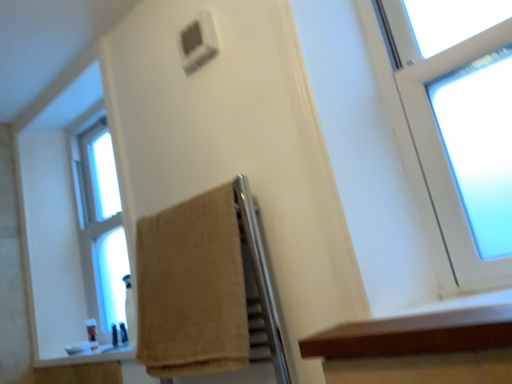
The image size is (512, 384). Describe the element at coordinates (192, 288) in the screenshot. I see `beige cotton towel at center` at that location.

Locate an element on the screen. translucent plastic soap at lower left is located at coordinates (91, 333).

Image resolution: width=512 pixels, height=384 pixels. What are the coordinates of `brown wood ledge at lower right` in the screenshot? It's located at (415, 334).

Locate an element on the screen. toiletry to the right of clear glass window at left is located at coordinates (91, 333).

Between clear glass window at left and translucent plastic soap at lower left, which one has more height?

Standing taller between the two is clear glass window at left.

From the image's perspective, is clear glass window at left above or below translucent plastic soap at lower left?

From the image's perspective, clear glass window at left appears above translucent plastic soap at lower left.

Could you tell me if clear glass window at left is facing translucent plastic soap at lower left?

Yes, clear glass window at left faces towards translucent plastic soap at lower left.

From their relative heights in the image, would you say clear glass window at left is taller or shorter than beige cotton towel at center?

Clearly, clear glass window at left is taller compared to beige cotton towel at center.

From the image's perspective, is clear glass window at left on top of beige cotton towel at center?

Correct, clear glass window at left appears higher than beige cotton towel at center in the image.

Considering the relative positions of clear glass window at left and beige cotton towel at center in the image provided, is clear glass window at left to the right of beige cotton towel at center from the viewer's perspective?

No, clear glass window at left is not to the right of beige cotton towel at center.

Looking at this image, is beige cotton towel at center aimed at translucent plastic soap at lower left?

No, beige cotton towel at center is not aimed at translucent plastic soap at lower left.

Can you confirm if beige cotton towel at center is taller than translucent plastic soap at lower left?

Yes, beige cotton towel at center is taller than translucent plastic soap at lower left.

Is beige cotton towel at center to the left of translucent plastic soap at lower left from the viewer's perspective?

No, beige cotton towel at center is not to the left of translucent plastic soap at lower left.

From a real-world perspective, relative to translucent plastic soap at lower left, is beige cotton towel at center vertically above or below?

beige cotton towel at center is situated higher than translucent plastic soap at lower left in the real world.

Looking at this image, could you tell me if translucent plastic soap at lower left is facing beige cotton towel at center?

No, translucent plastic soap at lower left is not facing towards beige cotton towel at center.

From a real-world perspective, between translucent plastic soap at lower left and beige cotton towel at center, who is vertically higher?

beige cotton towel at center is physically above.

Is translucent plastic soap at lower left touching beige cotton towel at center?

They are not placed beside each other.

Find the location of a particular element. The image size is (512, 384). window that is behind the brown wood ledge at lower right is located at coordinates (101, 226).

From a real-world perspective, who is located higher, brown wood ledge at lower right or clear glass window at left?

clear glass window at left.

Can you confirm if brown wood ledge at lower right is bigger than clear glass window at left?

No.

Would you say brown wood ledge at lower right is to the left or to the right of clear glass window at left in the picture?

Clearly, brown wood ledge at lower right is on the right of clear glass window at left in the image.

Does brown wood ledge at lower right contain beige cotton towel at center?

Definitely not — beige cotton towel at center is not inside brown wood ledge at lower right.

Is the position of brown wood ledge at lower right more distant than that of beige cotton towel at center?

No, brown wood ledge at lower right is closer to the camera.

The height and width of the screenshot is (384, 512). Identify the location of towel to the left of brown wood ledge at lower right. (192, 288).

Can you confirm if brown wood ledge at lower right is shorter than beige cotton towel at center?

Correct, brown wood ledge at lower right is not as tall as beige cotton towel at center.

In terms of width, does clear glass window at left look wider or thinner when compared to brown wood ledge at lower right?

Considering their sizes, clear glass window at left looks slimmer than brown wood ledge at lower right.

In the scene shown: Which of these two, clear glass window at left or brown wood ledge at lower right, stands shorter?

A: brown wood ledge at lower right is shorter.

Is clear glass window at left surrounding brown wood ledge at lower right?

No, brown wood ledge at lower right is not surrounded by clear glass window at left.

Locate an element on the screen. toiletry below the clear glass window at left (from a real-world perspective) is located at coordinates (91, 333).

Find the location of a particular element. This screenshot has width=512, height=384. towel below the clear glass window at left (from the image's perspective) is located at coordinates (192, 288).

From the image, which object appears to be nearer to translucent plastic soap at lower left, beige cotton towel at center or brown wood ledge at lower right?

beige cotton towel at center.

Which object lies nearer to the anchor point clear glass window at left, brown wood ledge at lower right or beige cotton towel at center?

Among the two, beige cotton towel at center is located nearer to clear glass window at left.

Which object lies nearer to the anchor point translucent plastic soap at lower left, brown wood ledge at lower right or beige cotton towel at center?

Based on the image, beige cotton towel at center appears to be nearer to translucent plastic soap at lower left.

Based on their spatial positions, is translucent plastic soap at lower left or clear glass window at left further from brown wood ledge at lower right?

translucent plastic soap at lower left is positioned further to the anchor brown wood ledge at lower right.

Considering their positions, is clear glass window at left positioned further to translucent plastic soap at lower left than beige cotton towel at center?

beige cotton towel at center lies further to translucent plastic soap at lower left than the other object.

Based on the photo, estimate the real-world distances between objects in this image. Which object is further from beige cotton towel at center, brown wood ledge at lower right or translucent plastic soap at lower left?

translucent plastic soap at lower left is further to beige cotton towel at center.

Which object lies nearer to the anchor point beige cotton towel at center, translucent plastic soap at lower left or brown wood ledge at lower right?

The object closer to beige cotton towel at center is brown wood ledge at lower right.

Based on their spatial positions, is clear glass window at left or beige cotton towel at center closer to brown wood ledge at lower right?

beige cotton towel at center is closer to brown wood ledge at lower right.

This screenshot has height=384, width=512. What are the coordinates of `towel positioned between brown wood ledge at lower right and translucent plastic soap at lower left from near to far` in the screenshot? It's located at (192, 288).

This screenshot has width=512, height=384. I want to click on towel between brown wood ledge at lower right and clear glass window at left from front to back, so click(x=192, y=288).

Where is `toiletry between brown wood ledge at lower right and clear glass window at left along the z-axis`? The height and width of the screenshot is (384, 512). toiletry between brown wood ledge at lower right and clear glass window at left along the z-axis is located at coordinates (91, 333).

At what (x,y) coordinates should I click in order to perform the action: click on toiletry located between beige cotton towel at center and clear glass window at left in the depth direction. Please return your answer as a coordinate pair (x, y). Image resolution: width=512 pixels, height=384 pixels. Looking at the image, I should click on (91, 333).